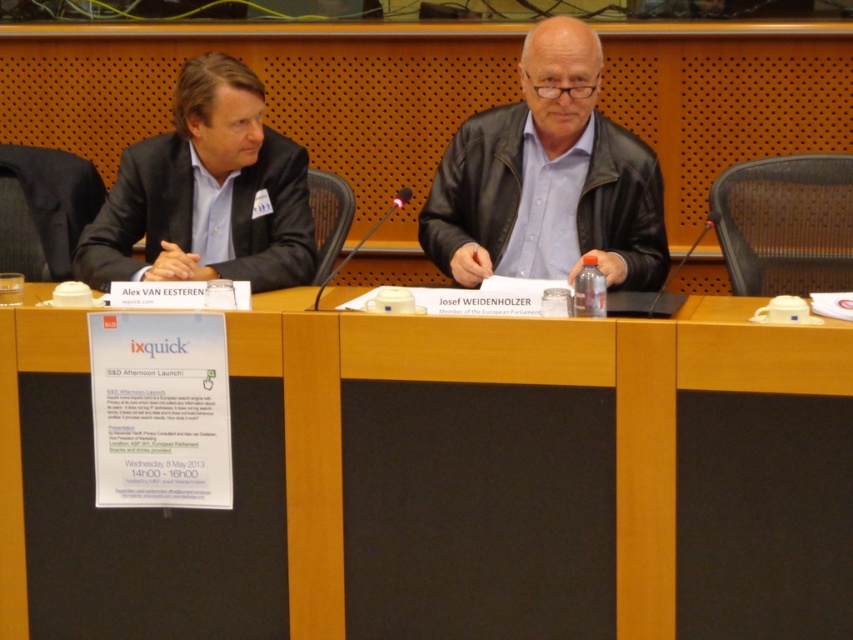
Can you confirm if wooden at center is shorter than leather jacket at center?

Incorrect, wooden at center's height does not fall short of leather jacket at center's.

Between wooden at center and leather jacket at center, which one appears on the right side from the viewer's perspective?

From the viewer's perspective, leather jacket at center appears more on the right side.

Is point (556, 416) farther from viewer compared to point (621, 189)?

No, (556, 416) is in front of (621, 189).

Identify the location of wooden at center. (451, 481).

Does leather jacket at center appear under matte black suit at left?

Incorrect, leather jacket at center is not positioned below matte black suit at left.

This screenshot has height=640, width=853. I want to click on leather jacket at center, so pos(556,164).

I want to click on leather jacket at center, so click(x=556, y=164).

Can you confirm if wooden at center is shorter than matte black suit at left?

No.

Can you confirm if wooden at center is bigger than matte black suit at left?

Indeed, wooden at center has a larger size compared to matte black suit at left.

Locate an element on the screen. This screenshot has width=853, height=640. wooden at center is located at coordinates (451, 481).